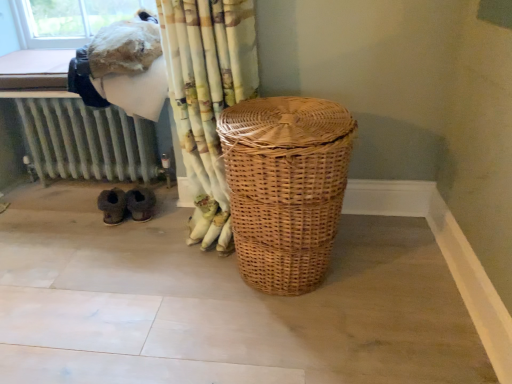
Question: Does brown suede slippers at lower left have a greater height compared to woven brown laundry basket at center?

Choices:
 (A) yes
 (B) no

Answer: (B)

Question: Does brown suede slippers at lower left lie behind woven brown laundry basket at center?

Choices:
 (A) yes
 (B) no

Answer: (A)

Question: Is brown suede slippers at lower left not near woven brown laundry basket at center?

Choices:
 (A) yes
 (B) no

Answer: (B)

Question: From the image's perspective, is brown suede slippers at lower left under woven brown laundry basket at center?

Choices:
 (A) no
 (B) yes

Answer: (B)

Question: From the image's perspective, is brown suede slippers at lower left above woven brown laundry basket at center?

Choices:
 (A) yes
 (B) no

Answer: (B)

Question: Is patterned fabric curtain at center taller or shorter than woven brown laundry basket at center?

Choices:
 (A) tall
 (B) short

Answer: (A)

Question: From a real-world perspective, is patterned fabric curtain at center above or below woven brown laundry basket at center?

Choices:
 (A) below
 (B) above

Answer: (B)

Question: From the image's perspective, is patterned fabric curtain at center above or below woven brown laundry basket at center?

Choices:
 (A) above
 (B) below

Answer: (A)

Question: Relative to woven brown laundry basket at center, is patterned fabric curtain at center in front or behind?

Choices:
 (A) front
 (B) behind

Answer: (B)

Question: Considering their positions, is woven brown laundry basket at center located in front of or behind brown suede slippers at lower left?

Choices:
 (A) behind
 (B) front

Answer: (B)

Question: Does point (251, 208) appear closer or farther from the camera than point (123, 192)?

Choices:
 (A) closer
 (B) farther

Answer: (A)

Question: In terms of width, does woven brown laundry basket at center look wider or thinner when compared to brown suede slippers at lower left?

Choices:
 (A) thin
 (B) wide

Answer: (B)

Question: Is woven brown laundry basket at center spatially inside brown suede slippers at lower left, or outside of it?

Choices:
 (A) inside
 (B) outside

Answer: (B)

Question: Is patterned fabric curtain at center taller or shorter than metallic radiator at lower left?

Choices:
 (A) tall
 (B) short

Answer: (A)

Question: Based on their sizes in the image, would you say patterned fabric curtain at center is bigger or smaller than metallic radiator at lower left?

Choices:
 (A) big
 (B) small

Answer: (A)